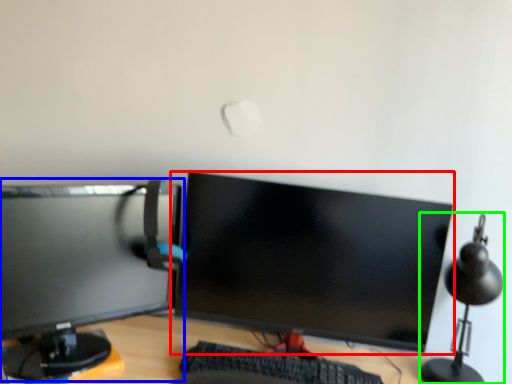
Question: Based on their relative distances, which object is farther from computer monitor (highlighted by a red box)? Choose from computer monitor (highlighted by a blue box) and table lamp (highlighted by a green box).

Choices:
 (A) computer monitor
 (B) table lamp

Answer: (B)